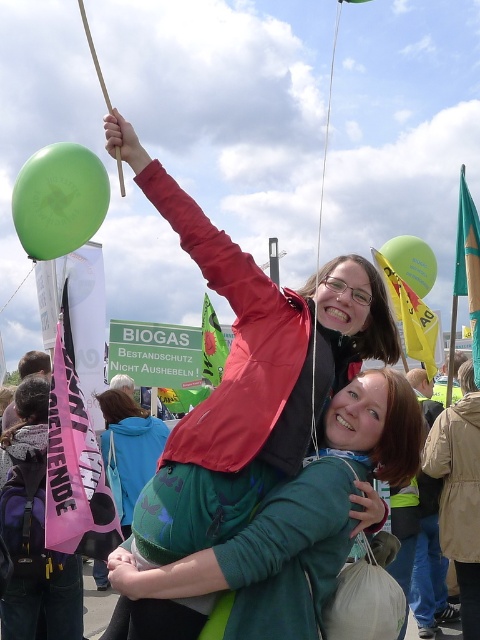
Question: Which of the following is the closest to the observer?

Choices:
 (A) matte red jacket at center
 (B) matte green hoodie at center
 (C) green rubber balloon at upper left

Answer: (A)

Question: Observing the image, what is the correct spatial positioning of green rubber balloon at upper left in reference to matte green hoodie at center?

Choices:
 (A) left
 (B) right

Answer: (A)

Question: Which point is closer to the camera?

Choices:
 (A) tap(396, 262)
 (B) tap(25, 243)
 (C) tap(139, 416)
 (D) tap(276, 381)

Answer: (D)

Question: Which object is farther from the camera taking this photo?

Choices:
 (A) green matte balloon at upper center
 (B) green fabric jacket at upper center
 (C) green rubber balloon at upper left

Answer: (A)

Question: Is matte red jacket at center to the right of green matte balloon at upper center from the viewer's perspective?

Choices:
 (A) yes
 (B) no

Answer: (B)

Question: Does green rubber balloon at upper left have a larger size compared to matte green hoodie at center?

Choices:
 (A) yes
 (B) no

Answer: (A)